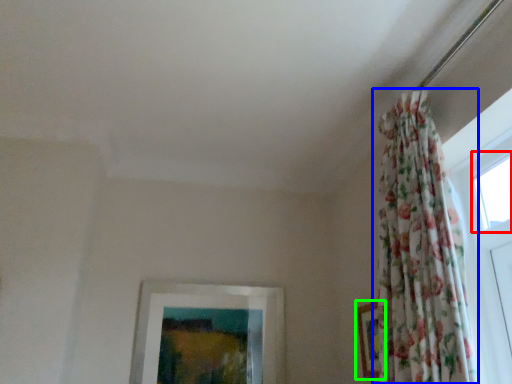
Question: Which object is the farthest from window (highlighted by a red box)? Choose among these: curtain (highlighted by a blue box) or picture frame (highlighted by a green box).

Choices:
 (A) curtain
 (B) picture frame

Answer: (B)